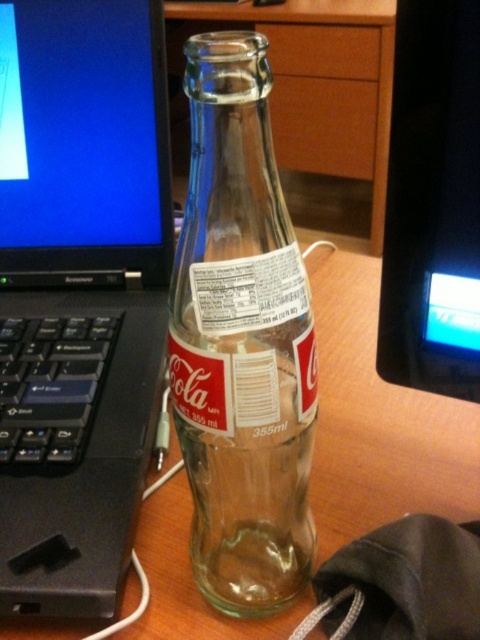
Question: Which object appears farthest from the camera in this image?

Choices:
 (A) black glossy monitor at upper right
 (B) clear glass bottle at center

Answer: (A)

Question: Which object appears closest to the camera in this image?

Choices:
 (A) clear glass bottle at center
 (B) wooden table at center
 (C) black plastic laptop at left
 (D) black glossy monitor at upper right

Answer: (A)

Question: Is wooden table at center behind black glossy monitor at upper right?

Choices:
 (A) yes
 (B) no

Answer: (A)

Question: Does black plastic laptop at left have a greater width compared to wooden table at center?

Choices:
 (A) no
 (B) yes

Answer: (A)

Question: Which point is farther from the camera taking this photo?

Choices:
 (A) (100, 68)
 (B) (324, 404)
 (C) (288, 369)
 (D) (422, 378)

Answer: (B)

Question: Can you confirm if black plastic laptop at left is positioned to the right of wooden table at center?

Choices:
 (A) no
 (B) yes

Answer: (A)